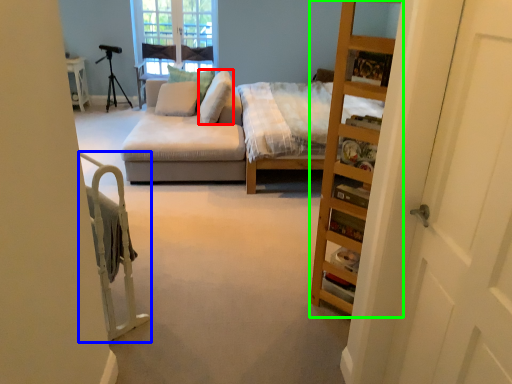
Question: Estimate the real-world distances between objects in this image. Which object is closer to pillow (highlighted by a red box), bed frame (highlighted by a blue box) or cabinet (highlighted by a green box)?

Choices:
 (A) bed frame
 (B) cabinet

Answer: (A)